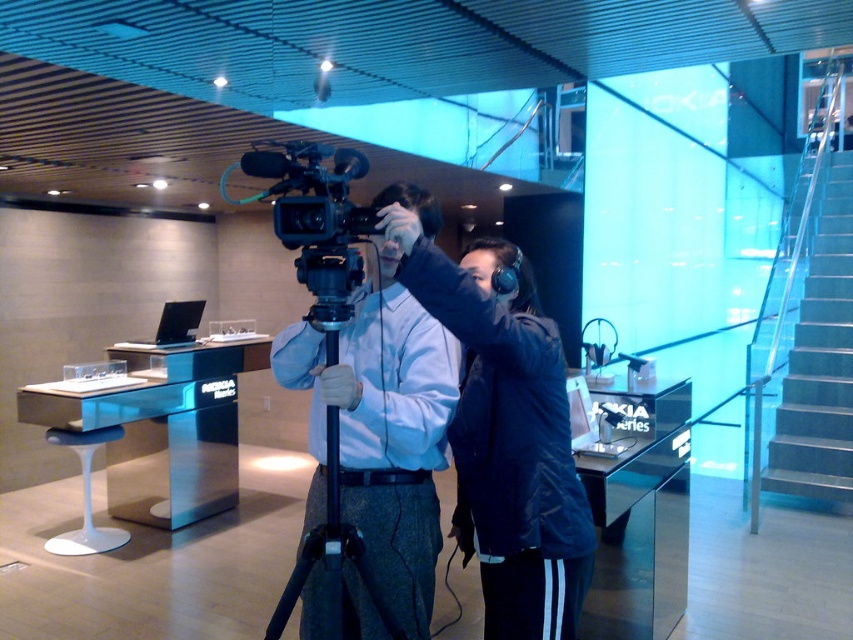
Does dark blue jacket at center have a greater height compared to black plastic video camera at center?

Indeed, dark blue jacket at center has a greater height compared to black plastic video camera at center.

Find the location of a particular element. This screenshot has width=853, height=640. dark blue jacket at center is located at coordinates (505, 433).

Between point (544, 410) and point (315, 230), which one is positioned in front?

Positioned in front is point (315, 230).

Where is `dark blue jacket at center`? dark blue jacket at center is located at coordinates (505, 433).

Between black plastic video camera at center and black plastic tripod at center, which one is positioned lower?

Positioned lower is black plastic tripod at center.

Measure the distance between black plastic video camera at center and camera.

The distance of black plastic video camera at center from camera is 5.04 feet.

Who is more forward, (289, 152) or (285, 586)?

Point (289, 152) is more forward.

This screenshot has width=853, height=640. I want to click on black plastic video camera at center, so click(x=316, y=218).

Is point (553, 540) in front of point (335, 488)?

That is False.

Does dark blue jacket at center have a lesser height compared to black plastic tripod at center?

In fact, dark blue jacket at center may be taller than black plastic tripod at center.

What are the coordinates of `dark blue jacket at center` in the screenshot? It's located at (505, 433).

Identify the location of dark blue jacket at center. The width and height of the screenshot is (853, 640). (505, 433).